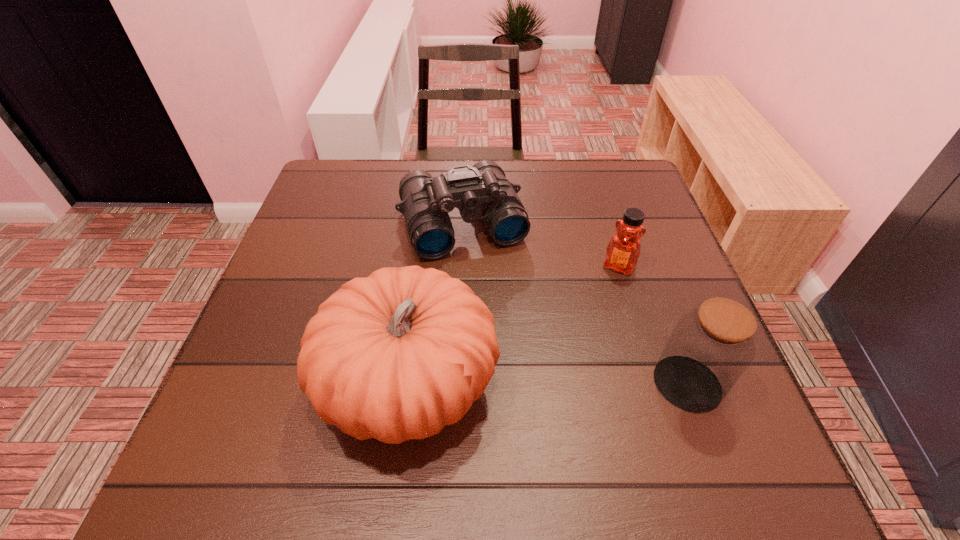
Identify the location of free area in between the honey and the binoculars. This screenshot has height=540, width=960. click(x=540, y=245).

I want to click on blank region between the jar and the honey, so click(653, 325).

The image size is (960, 540). Find the location of `vacant area that lies between the jar and the pumpkin`. vacant area that lies between the jar and the pumpkin is located at coordinates (548, 384).

Identify which object is the third nearest to the binoculars. Please provide its 2D coordinates. Your answer should be formatted as a tuple, i.e. [(x, y)], where the tuple contains the x and y coordinates of a point satisfying the conditions above.

[(710, 347)]

Where is `object that is the second closest to the pumpkin`? The image size is (960, 540). object that is the second closest to the pumpkin is located at coordinates pos(623,250).

The height and width of the screenshot is (540, 960). In order to click on free space that satisfies the following two spatial constraints: 1. on the back side of the pumpkin; 2. on the right side of the binoculars in this screenshot , I will do `click(430, 223)`.

You are a GUI agent. You are given a task and a screenshot of the screen. Output one action in this format:
    pyautogui.click(x=<x>, y=<y>)
    Task: Click on the vacant position in the image that satisfies the following two spatial constraints: 1. on the front side of the jar; 2. on the right side of the honey
    
    Given the screenshot: What is the action you would take?
    pyautogui.click(x=655, y=383)

You are a GUI agent. You are given a task and a screenshot of the screen. Output one action in this format:
    pyautogui.click(x=<x>, y=<y>)
    Task: Click on the vacant space that satisfies the following two spatial constraints: 1. on the front side of the jar; 2. on the right side of the binoculars
    This screenshot has height=540, width=960.
    Given the screenshot: What is the action you would take?
    pyautogui.click(x=455, y=383)

Where is `vacant space that satisfies the following two spatial constraints: 1. on the front side of the jar; 2. on the right side of the honey`? This screenshot has height=540, width=960. vacant space that satisfies the following two spatial constraints: 1. on the front side of the jar; 2. on the right side of the honey is located at coordinates (655, 383).

The image size is (960, 540). What are the coordinates of `free point that satisfies the following two spatial constraints: 1. on the back side of the pumpkin; 2. on the right side of the honey` in the screenshot? It's located at (424, 266).